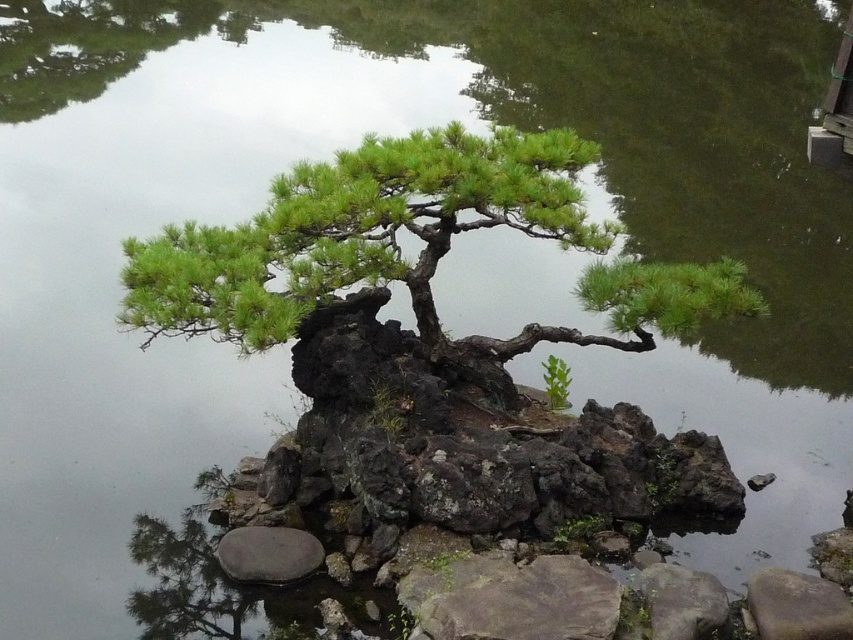
The height and width of the screenshot is (640, 853). Describe the element at coordinates (798, 605) in the screenshot. I see `gray rough stone at lower right` at that location.

Is gray rough stone at lower right shorter than smooth gray stone at lower left?

Incorrect, gray rough stone at lower right's height does not fall short of smooth gray stone at lower left's.

Does point (746, 584) lie behind point (265, 544)?

Yes.

Identify the location of gray rough stone at lower right. This screenshot has width=853, height=640. (798, 605).

Can you confirm if green textured bonsai at center is bigger than gray rough stone at center?

Correct, green textured bonsai at center is larger in size than gray rough stone at center.

Does green textured bonsai at center appear on the right side of gray rough stone at center?

No, green textured bonsai at center is not to the right of gray rough stone at center.

Is point (440, 188) more distant than point (439, 628)?

Yes.

I want to click on green textured bonsai at center, so click(x=418, y=252).

Does gray rough stone at center have a greater width compared to smooth gray stone at lower left?

Yes, gray rough stone at center is wider than smooth gray stone at lower left.

Which is behind, point (430, 570) or point (292, 538)?

The point (292, 538) is behind.

Between point (509, 582) and point (254, 548), which one is positioned behind?

The point (254, 548) is more distant.

This screenshot has width=853, height=640. What are the coordinates of `gray rough stone at center` in the screenshot? It's located at (512, 598).